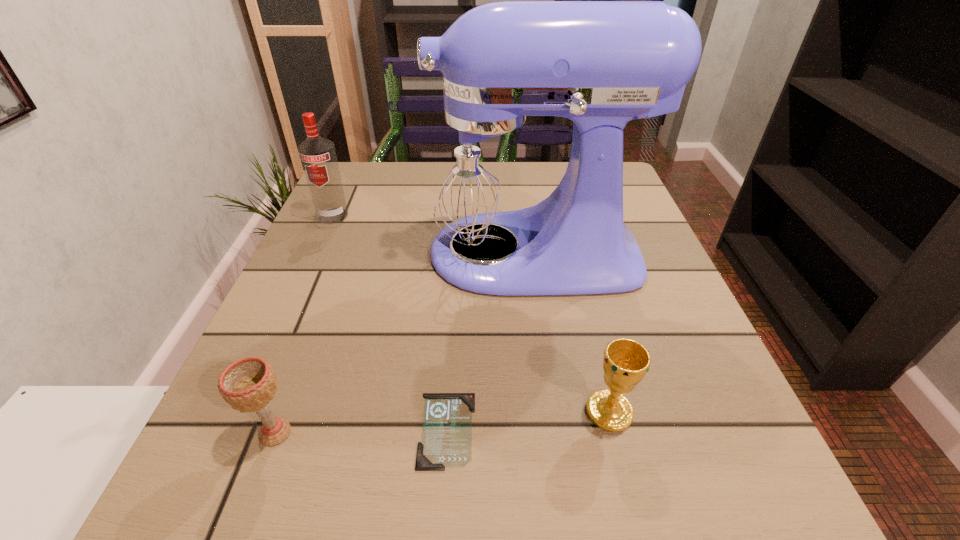
Image resolution: width=960 pixels, height=540 pixels. I want to click on vacant area situated on the back of the right chalice, so click(568, 244).

The height and width of the screenshot is (540, 960). In order to click on free spot located 0.080m on the right of the shortest object in this screenshot , I will do `click(532, 430)`.

Where is `object that is at the far edge`? This screenshot has width=960, height=540. object that is at the far edge is located at coordinates (318, 157).

Where is `object present at the near edge`? This screenshot has height=540, width=960. object present at the near edge is located at coordinates (446, 441).

Find the location of a particular element. Image resolution: width=960 pixels, height=540 pixels. vodka situated at the left edge is located at coordinates (318, 157).

Identify the location of chalice present at the left edge. The height and width of the screenshot is (540, 960). (248, 384).

Where is `mixer present at the right edge`? mixer present at the right edge is located at coordinates (487, 176).

The width and height of the screenshot is (960, 540). I want to click on chalice that is at the right edge, so click(x=626, y=362).

Where is `object that is at the far left corner`? The height and width of the screenshot is (540, 960). object that is at the far left corner is located at coordinates (318, 157).

Where is `free space at the far edge`? free space at the far edge is located at coordinates (401, 175).